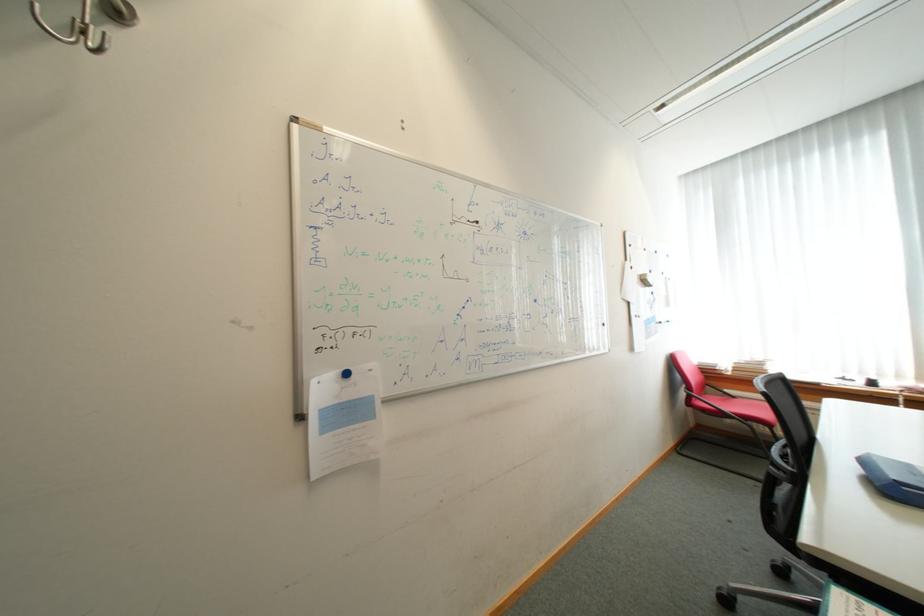
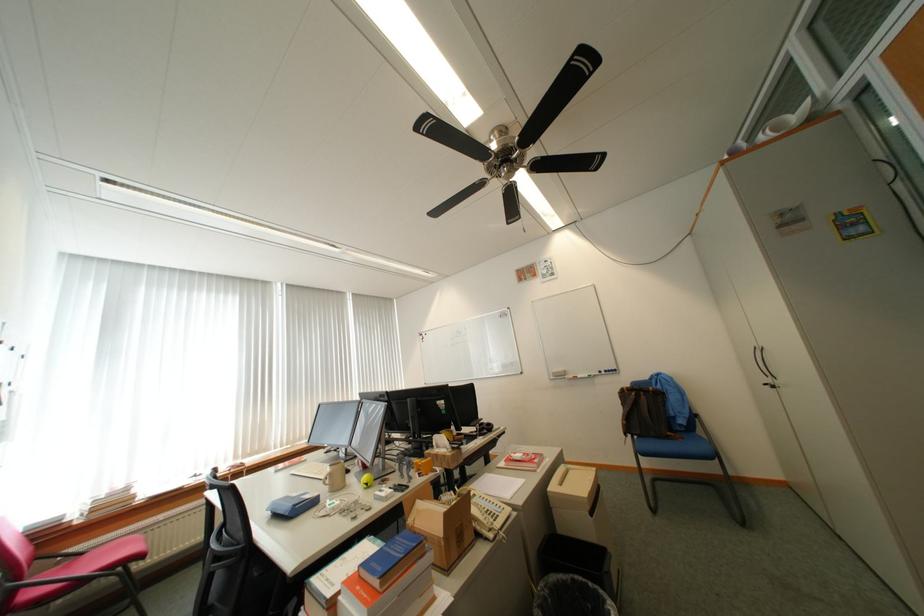
Where in the second image is the point corresponding to the point at 743,398 from the first image?

(91, 554)